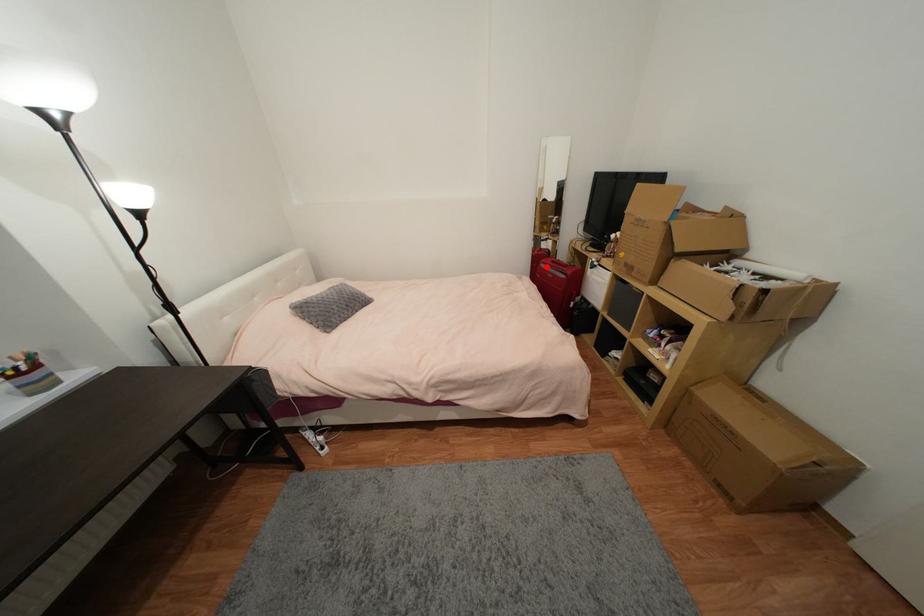
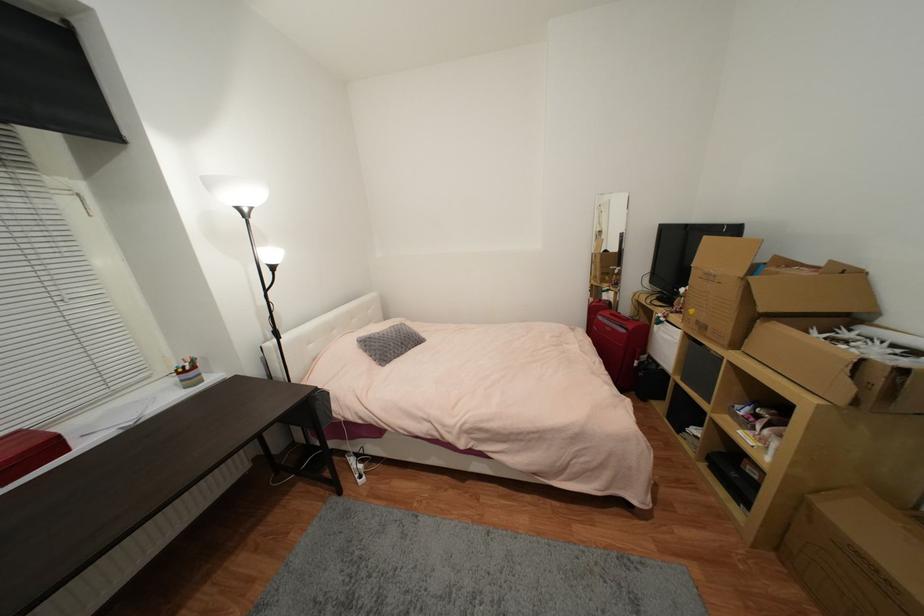
Where in the second image is the point corresponding to the highlighted location from the first image?

(603, 318)